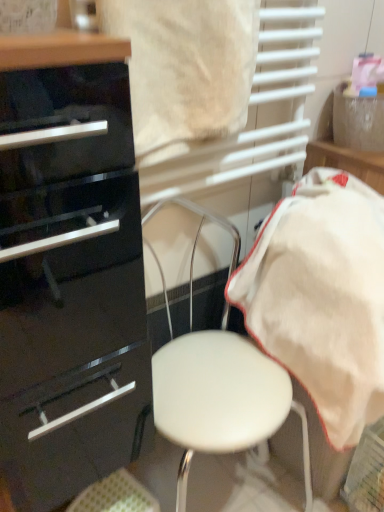
Describe the element at coordinates (69, 269) in the screenshot. The image size is (384, 512). I see `glossy black chest of drawers at left` at that location.

The height and width of the screenshot is (512, 384). What do you see at coordinates (322, 297) in the screenshot? I see `white cotton towel at right` at bounding box center [322, 297].

This screenshot has width=384, height=512. What are the coordinates of `glossy black chest of drawers at left` in the screenshot? It's located at (69, 269).

How many degrees apart are the facing directions of white cotton towel at right and glossy black chest of drawers at left?

The facing directions of white cotton towel at right and glossy black chest of drawers at left are 1.47 degrees apart.

Is white cotton towel at right facing away from glossy black chest of drawers at left?

That's not correct — white cotton towel at right is not looking away from glossy black chest of drawers at left.

From a real-world perspective, is white cotton towel at right on glossy black chest of drawers at left?

No, from a real-world perspective, white cotton towel at right is not on top of glossy black chest of drawers at left.

Between white cotton towel at right and glossy black chest of drawers at left, which one has less height?

white cotton towel at right is shorter.

Does point (215, 418) lie behind point (326, 379)?

No, (215, 418) is in front of (326, 379).

From the image's perspective, which one is positioned lower, white leather stool at center or white cotton towel at right?

From the image's view, white leather stool at center is below.

Is white leather stool at center located outside white cotton towel at right?

Absolutely, white leather stool at center is external to white cotton towel at right.

Based on the photo, does white leather stool at center turn towards white cotton towel at right?

No, white leather stool at center is not facing towards white cotton towel at right.

Is glossy black chest of drawers at left next to white cotton towel at right and touching it?

No, glossy black chest of drawers at left is not beside white cotton towel at right.

Measure the distance from glossy black chest of drawers at left to white cotton towel at right.

They are 21.39 inches apart.

Could you tell me if glossy black chest of drawers at left is facing white cotton towel at right?

No, glossy black chest of drawers at left is not oriented towards white cotton towel at right.

Where is `bedding lying on the right of glossy black chest of drawers at left`? Image resolution: width=384 pixels, height=512 pixels. bedding lying on the right of glossy black chest of drawers at left is located at coordinates (322, 297).

Based on the photo, from the image's perspective, is white leather stool at center above or below glossy black chest of drawers at left?

Based on their image positions, white leather stool at center is located beneath glossy black chest of drawers at left.

Can you confirm if white leather stool at center is shorter than glossy black chest of drawers at left?

Indeed, white leather stool at center has a lesser height compared to glossy black chest of drawers at left.

Could you tell me if white leather stool at center is turned towards glossy black chest of drawers at left?

No, white leather stool at center is not oriented towards glossy black chest of drawers at left.

Is white leather stool at center not inside glossy black chest of drawers at left?

Yes.

Where is `chair below the glossy black chest of drawers at left (from the image's perspective)`? This screenshot has width=384, height=512. chair below the glossy black chest of drawers at left (from the image's perspective) is located at coordinates (218, 383).

Does point (25, 174) come behind point (203, 425)?

Yes, point (25, 174) is farther from viewer.

Considering the relative sizes of glossy black chest of drawers at left and white leather stool at center in the image provided, is glossy black chest of drawers at left shorter than white leather stool at center?

No, glossy black chest of drawers at left is not shorter than white leather stool at center.

From the image's perspective, is glossy black chest of drawers at left located beneath white leather stool at center?

Actually, glossy black chest of drawers at left appears above white leather stool at center in the image.

Is white cotton towel at right positioned with its back to white leather stool at center?

That's not correct — white cotton towel at right is not looking away from white leather stool at center.

Is white cotton towel at right inside or outside of white leather stool at center?

white cotton towel at right cannot be found inside white leather stool at center.

How many degrees apart are the facing directions of white cotton towel at right and white leather stool at center?

1.24e-05 degrees.

Can you confirm if white cotton towel at right is smaller than white leather stool at center?

Indeed, white cotton towel at right has a smaller size compared to white leather stool at center.

Locate an element on the screen. Image resolution: width=384 pixels, height=512 pixels. bedding below the glossy black chest of drawers at left (from a real-world perspective) is located at coordinates 322,297.

Locate an element on the screen. Image resolution: width=384 pixels, height=512 pixels. bedding behind the white leather stool at center is located at coordinates (322, 297).

Considering their positions, is white cotton towel at right positioned further to glossy black chest of drawers at left than white leather stool at center?

white cotton towel at right.

When comparing their distances from white leather stool at center, does white cotton towel at right or glossy black chest of drawers at left seem further?

glossy black chest of drawers at left lies further to white leather stool at center than the other object.

Which object lies further to the anchor point white cotton towel at right, glossy black chest of drawers at left or white leather stool at center?

The object further to white cotton towel at right is glossy black chest of drawers at left.

When comparing their distances from glossy black chest of drawers at left, does white leather stool at center or white cotton towel at right seem closer?

Based on the image, white leather stool at center appears to be nearer to glossy black chest of drawers at left.

Estimate the real-world distances between objects in this image. Which object is closer to white leather stool at center, glossy black chest of drawers at left or white cotton towel at right?

Among the two, white cotton towel at right is located nearer to white leather stool at center.

Estimate the real-world distances between objects in this image. Which object is closer to white cotton towel at right, white leather stool at center or glossy black chest of drawers at left?

The object closer to white cotton towel at right is white leather stool at center.

This screenshot has height=512, width=384. What are the coordinates of `chair situated between glossy black chest of drawers at left and white cotton towel at right from left to right` in the screenshot? It's located at (218, 383).